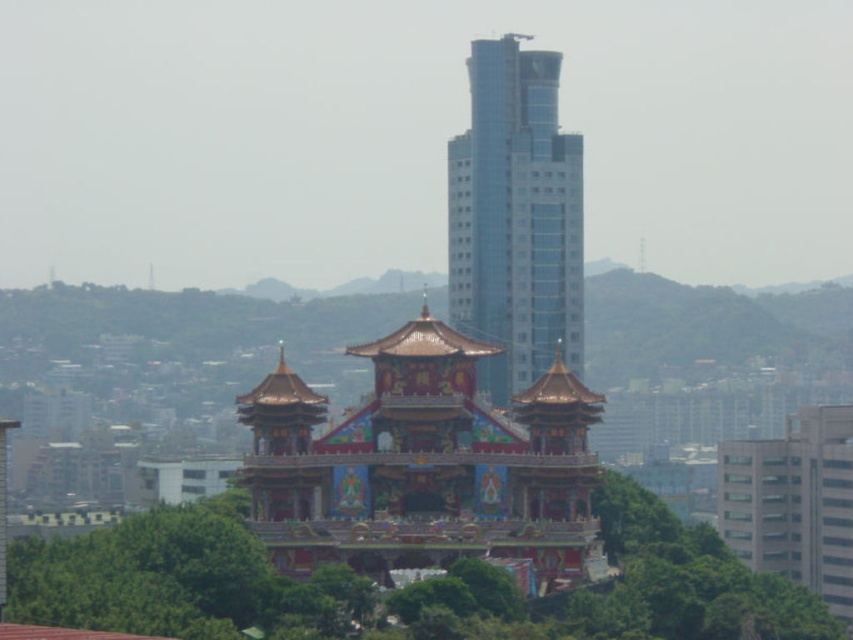
Does green leafy tree at center have a greater height compared to glassy blue skyscraper at center?

In fact, green leafy tree at center may be shorter than glassy blue skyscraper at center.

Does green leafy tree at center appear under glassy blue skyscraper at center?

Indeed, green leafy tree at center is positioned under glassy blue skyscraper at center.

Who is more distant from viewer, (x=190, y=545) or (x=497, y=225)?

Positioned behind is point (x=497, y=225).

Locate an element on the screen. green leafy tree at center is located at coordinates (178, 579).

Is gilded ornate pagoda at center thinner than green leafy tree at center?

Indeed, gilded ornate pagoda at center has a lesser width compared to green leafy tree at center.

The width and height of the screenshot is (853, 640). What are the coordinates of `gilded ornate pagoda at center` in the screenshot? It's located at (426, 467).

Is gilded ornate pagoda at center below glassy blue skyscraper at center?

Yes.

Which is in front, point (515, 524) or point (503, 307)?

Point (515, 524) is in front.

Where is `gilded ornate pagoda at center`? This screenshot has width=853, height=640. gilded ornate pagoda at center is located at coordinates (426, 467).